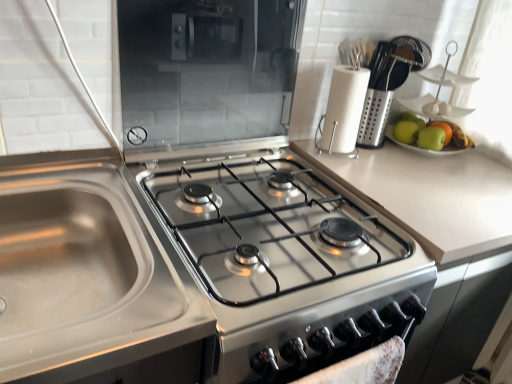
Question: Do you think stainless steel gas stove at center is within transparent glass microwave at upper center, or outside of it?

Choices:
 (A) outside
 (B) inside

Answer: (A)

Question: From a real-world perspective, is stainless steel gas stove at center above or below transparent glass microwave at upper center?

Choices:
 (A) above
 (B) below

Answer: (B)

Question: Based on their relative distances, which object is farther from the green matte apple at upper right, acting as the 2th apple starting from the right?

Choices:
 (A) white paper towel at upper right
 (B) transparent glass microwave at upper center
 (C) green matte apple at right, which is counted as the first apple, starting from the right
 (D) green matte apple at upper right, which ranks as the 1th apple in left-to-right order
 (E) stainless steel sink at lower left

Answer: (E)

Question: Based on their relative distances, which object is farther from the green matte apple at upper right, which ranks as the third apple in right-to-left order?

Choices:
 (A) transparent glass microwave at upper center
 (B) green matte apple at upper right, which appears as the second apple when viewed from the left
 (C) stainless steel sink at lower left
 (D) white paper towel at upper right
 (E) stainless steel gas stove at center

Answer: (C)